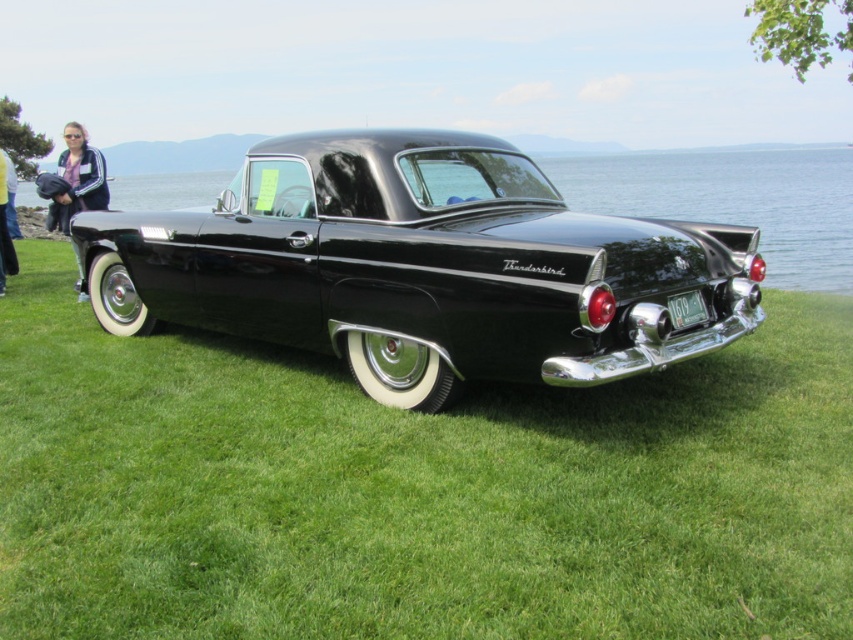
Question: Is glossy black thunderbird at center wider than matte black jacket at left?

Choices:
 (A) no
 (B) yes

Answer: (B)

Question: Which point appears farthest from the camera in this image?

Choices:
 (A) (0, 157)
 (B) (91, 160)

Answer: (A)

Question: Which object appears closest to the camera in this image?

Choices:
 (A) matte black jacket at left
 (B) denim pants at left

Answer: (A)

Question: Can you confirm if glossy black thunderbird at center is positioned to the left of denim pants at left?

Choices:
 (A) yes
 (B) no

Answer: (B)

Question: Does glossy black thunderbird at center appear over matte black jacket at left?

Choices:
 (A) yes
 (B) no

Answer: (B)

Question: Which point appears closest to the camera in this image?

Choices:
 (A) (680, 321)
 (B) (10, 244)
 (C) (77, 289)

Answer: (A)